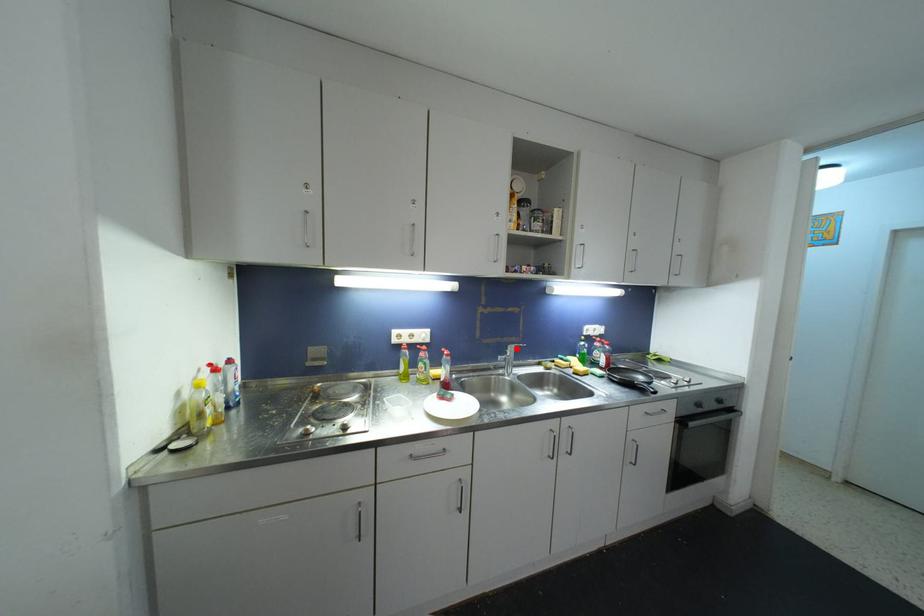
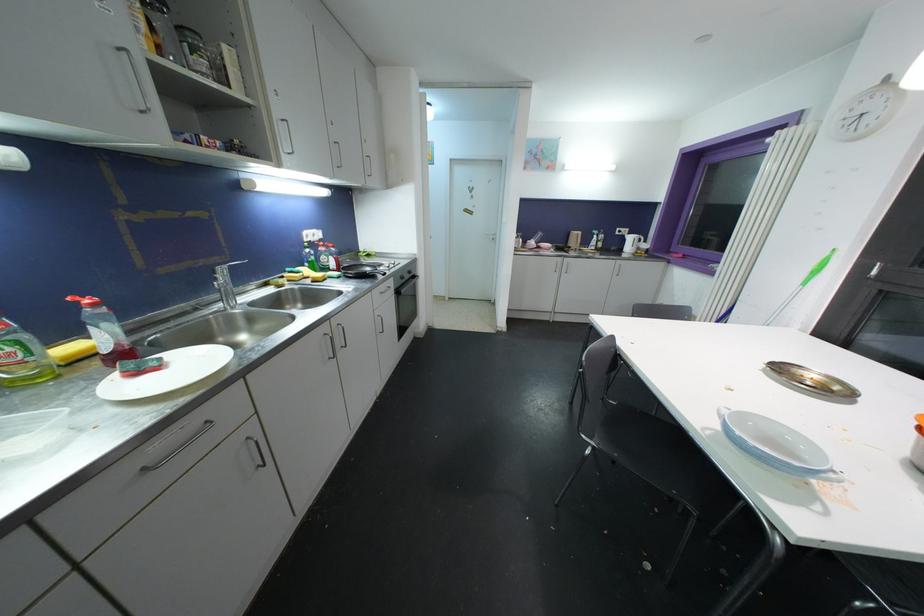
Where in the second image is the point corresponding to the highlighted location from the first image?

(228, 270)